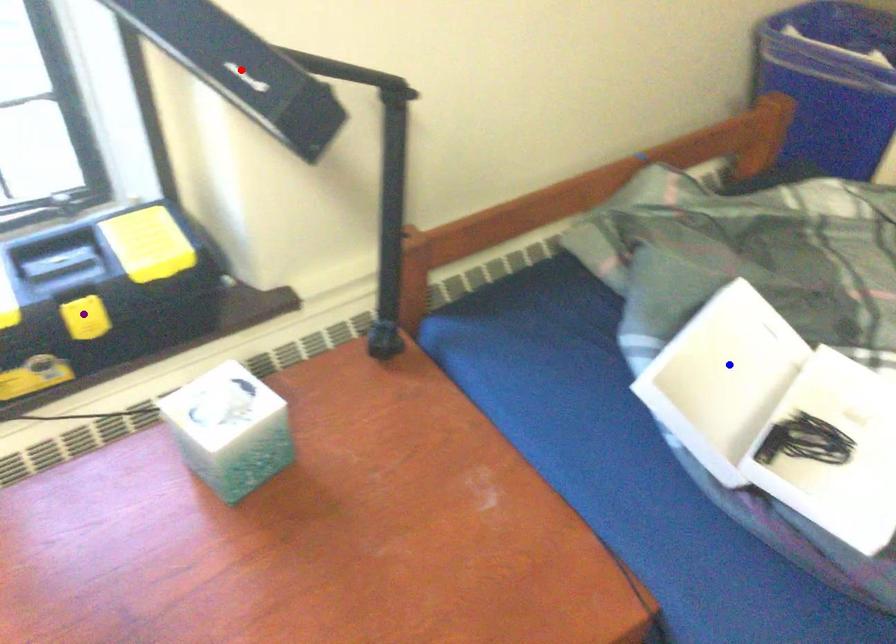
Order these from farthest to nearest:
blue point
red point
purple point

blue point, purple point, red point